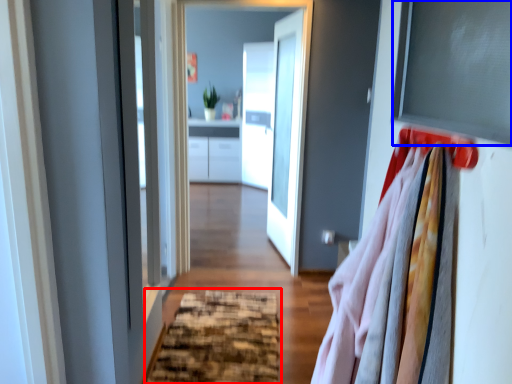
Question: Which object appears farthest to the camera in this image, doormat (highlighted by a red box) or window screen (highlighted by a blue box)?

Choices:
 (A) doormat
 (B) window screen

Answer: (A)